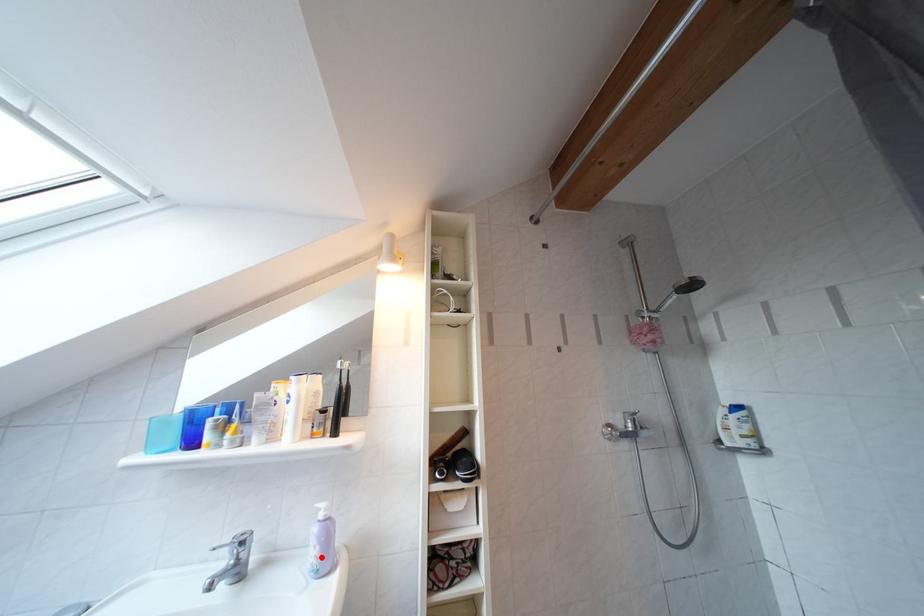
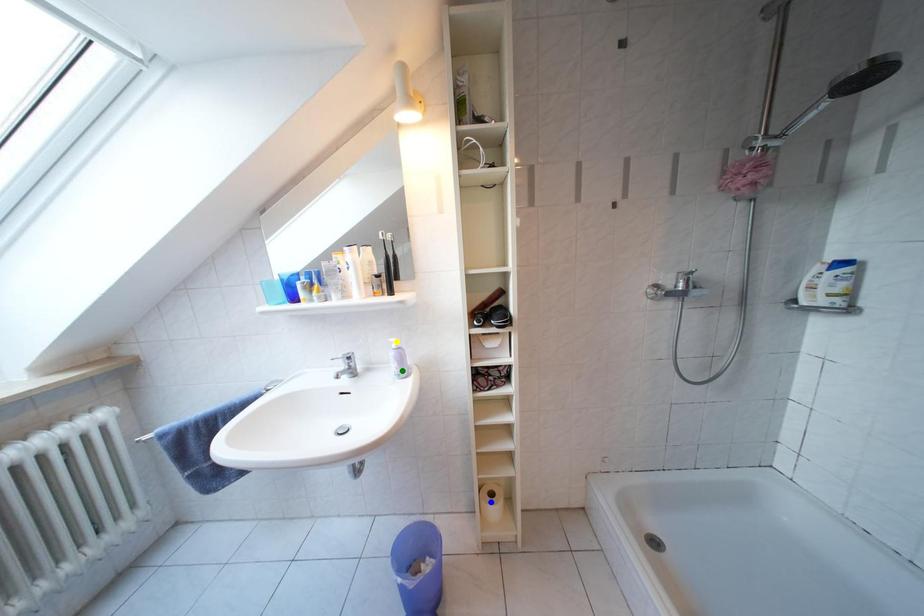
Question: I am providing you with two images of the same scene from different viewpoints. A red point is marked on the first image. You are given multiple points on the second image. Which point in image 2 is actually the same real-world point as the red point in image 1?

Choices:
 (A) yellow point
 (B) blue point
 (C) green point

Answer: (C)